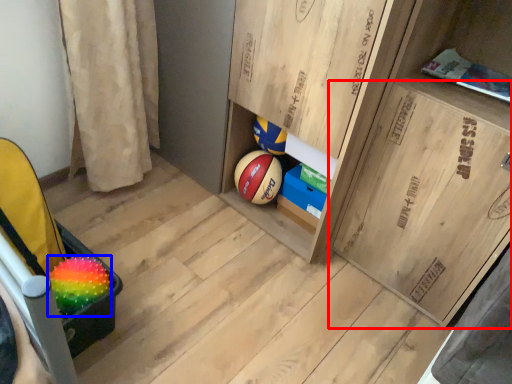
Question: Which object appears closest to the camera in this image, cabinetry (highlighted by a red box) or ball (highlighted by a blue box)?

Choices:
 (A) cabinetry
 (B) ball

Answer: (A)